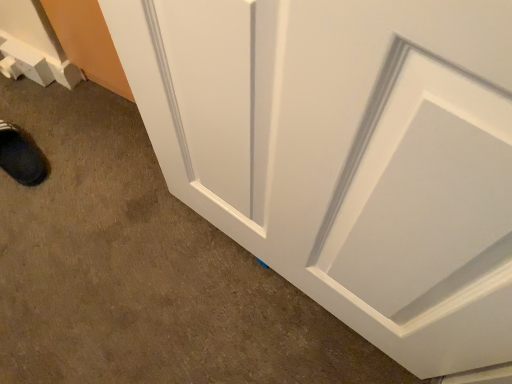
Where is `black fabric slipper at lower left`? The width and height of the screenshot is (512, 384). black fabric slipper at lower left is located at coordinates (21, 156).

Describe the element at coordinates (21, 156) in the screenshot. The image size is (512, 384). I see `black fabric slipper at lower left` at that location.

Locate an element on the screen. The height and width of the screenshot is (384, 512). black fabric slipper at lower left is located at coordinates (21, 156).